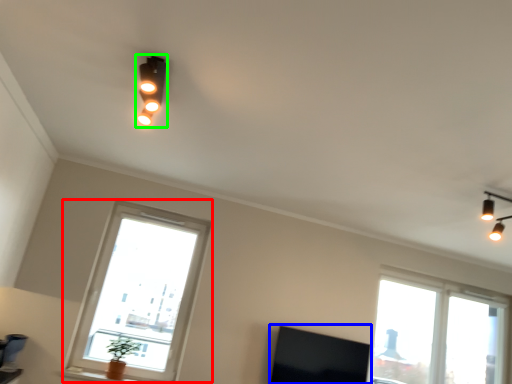
Question: Which object is positioned closest to window (highlighted by a red box)? Select from window screen (highlighted by a blue box) and lamp (highlighted by a green box).

Choices:
 (A) window screen
 (B) lamp

Answer: (A)